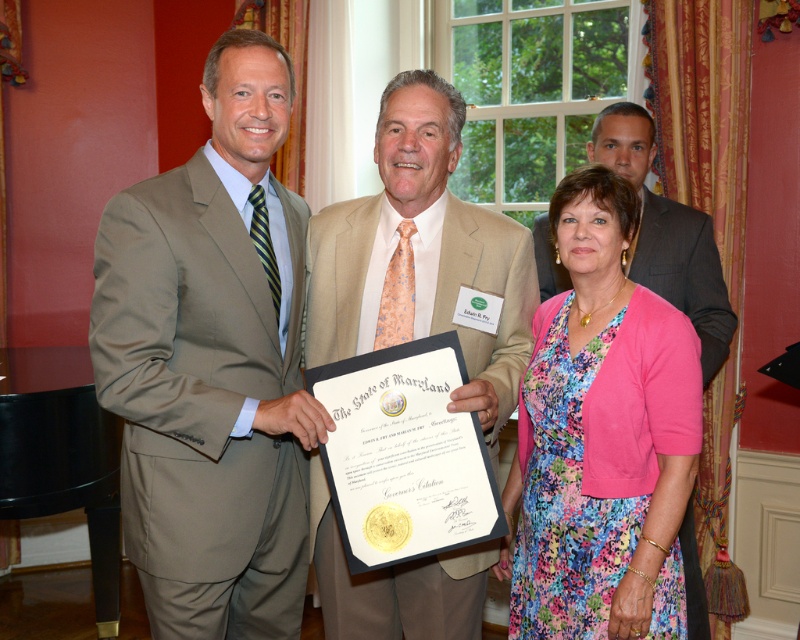
Question: Which object is farther from the camera taking this photo?

Choices:
 (A) satin tan suit at center
 (B) floral dress at center
 (C) light beige suit at center

Answer: (B)

Question: Which point is farther to the camera?

Choices:
 (A) satin tan suit at center
 (B) floral dress at center
 (C) light beige suit at center

Answer: (B)

Question: Which object is the farthest from the floral dress at center?

Choices:
 (A) light beige suit at center
 (B) satin tan suit at center

Answer: (B)

Question: Is satin tan suit at center thinner than light beige suit at center?

Choices:
 (A) no
 (B) yes

Answer: (B)

Question: Considering the relative positions of satin tan suit at center and floral dress at center in the image provided, where is satin tan suit at center located with respect to floral dress at center?

Choices:
 (A) right
 (B) left

Answer: (B)

Question: Is satin tan suit at center above floral dress at center?

Choices:
 (A) no
 (B) yes

Answer: (B)